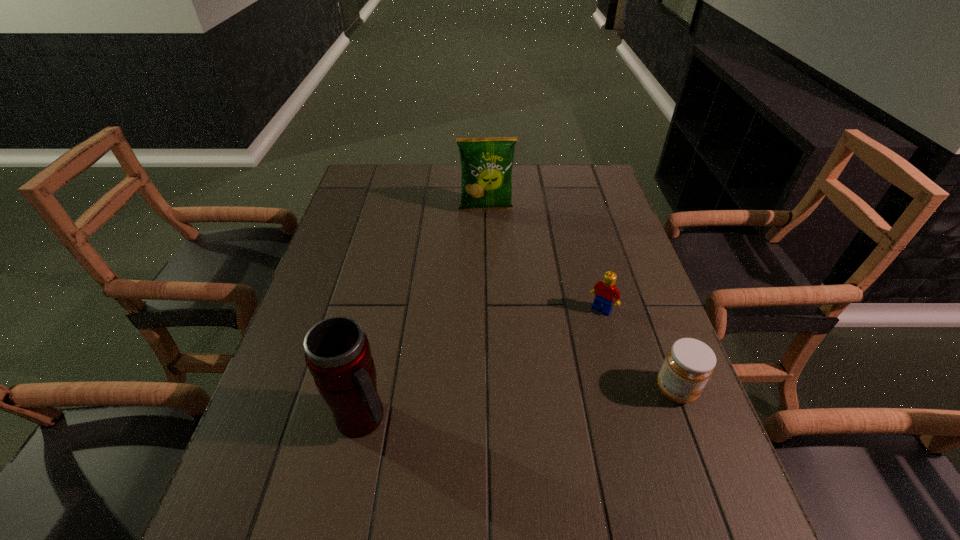
Locate an element on the screen. The height and width of the screenshot is (540, 960). vacant space on the desktop that is between the leftmost object and the rightmost object and is positioned on the front-facing side of the third object from left to right is located at coordinates click(536, 403).

Locate an element on the screen. This screenshot has width=960, height=540. free space on the desktop that is between the thermos bottle and the rightmost object and is positioned on the front-facing side of the crisp (potato chip) is located at coordinates point(512,405).